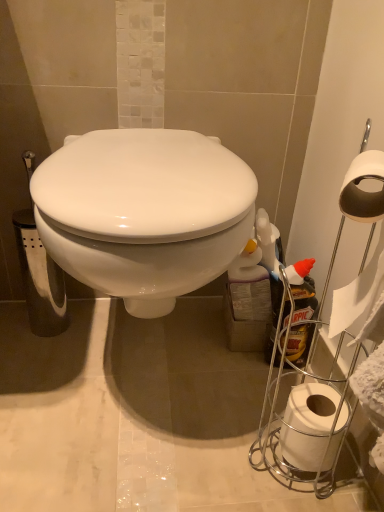
Question: From the image's perspective, is white paper at right below white plastic spray bottle at right?

Choices:
 (A) no
 (B) yes

Answer: (B)

Question: Could you tell me if white paper at right is turned towards white plastic spray bottle at right?

Choices:
 (A) no
 (B) yes

Answer: (A)

Question: Are white paper at right and white plastic spray bottle at right far apart?

Choices:
 (A) yes
 (B) no

Answer: (B)

Question: Is white paper at right further to the viewer compared to white plastic spray bottle at right?

Choices:
 (A) no
 (B) yes

Answer: (A)

Question: From the image's perspective, is white paper at right over white plastic spray bottle at right?

Choices:
 (A) yes
 (B) no

Answer: (B)

Question: Does white paper at right have a lesser width compared to white plastic spray bottle at right?

Choices:
 (A) yes
 (B) no

Answer: (B)

Question: From the image's perspective, is white plastic spray bottle at right over white paper at right?

Choices:
 (A) yes
 (B) no

Answer: (A)

Question: Does white plastic spray bottle at right appear on the right side of white paper at right?

Choices:
 (A) yes
 (B) no

Answer: (A)

Question: Can you confirm if white plastic spray bottle at right is thinner than white paper at right?

Choices:
 (A) no
 (B) yes

Answer: (B)

Question: Does white plastic spray bottle at right have a greater width compared to white paper at right?

Choices:
 (A) no
 (B) yes

Answer: (A)

Question: Considering the relative sizes of white plastic spray bottle at right and white paper at right in the image provided, is white plastic spray bottle at right smaller than white paper at right?

Choices:
 (A) yes
 (B) no

Answer: (B)

Question: From a real-world perspective, is white plastic spray bottle at right beneath white paper at right?

Choices:
 (A) yes
 (B) no

Answer: (B)

Question: Does point (301, 352) appear closer or farther from the camera than point (284, 446)?

Choices:
 (A) closer
 (B) farther

Answer: (B)